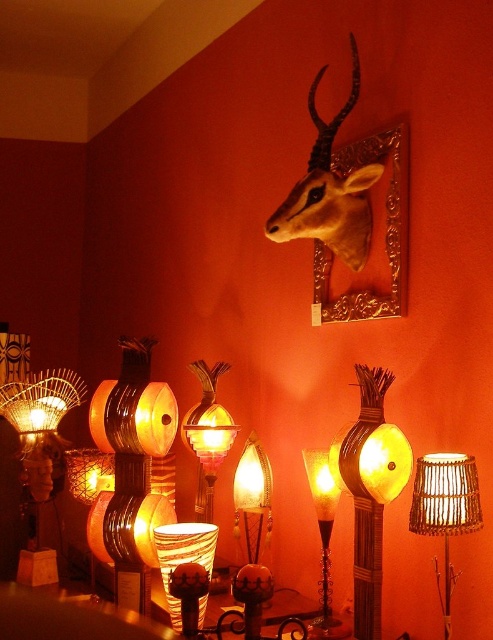
Question: Does woven bamboo lamp at center have a larger size compared to translucent glass lamp at center?

Choices:
 (A) no
 (B) yes

Answer: (B)

Question: Does woven bamboo lamp at center have a greater width compared to woven bamboo lampshade at center?

Choices:
 (A) no
 (B) yes

Answer: (B)

Question: Which point appears closest to the camera in this image?

Choices:
 (A) (x=175, y=566)
 (B) (x=360, y=244)

Answer: (A)

Question: Which object is the farthest from the matte brown deer head at upper center?

Choices:
 (A) woven bamboo lampshade at center
 (B) translucent glass lamp at center

Answer: (A)

Question: Estimate the real-world distances between objects in this image. Which object is closer to the matte wicker lamp at left?

Choices:
 (A) translucent marbled glass lampshade at center
 (B) woven bamboo lamp at center

Answer: (A)

Question: Can you confirm if woven bamboo lampshade at center is positioned below translucent marbled glass lampshade at center?

Choices:
 (A) yes
 (B) no

Answer: (B)